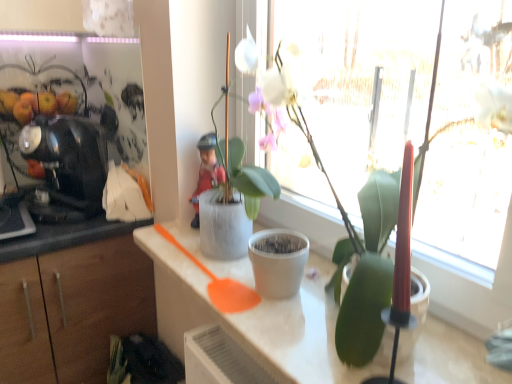
The image size is (512, 384). What are the coordinates of `white matte pot at center, arranged as the second houseplant when viewed from the front` in the screenshot? It's located at (233, 204).

Where is `white matte countertop at center`? The width and height of the screenshot is (512, 384). white matte countertop at center is located at coordinates (253, 318).

Measure the distance between point (344, 257) and camera.

The depth of point (344, 257) is 26.54 inches.

Identify the location of black glossy coffee machine at left. (67, 165).

Where is `matte red figurine at center`? This screenshot has height=384, width=512. matte red figurine at center is located at coordinates (208, 165).

What do you see at coordinates (208, 165) in the screenshot? I see `matte red figurine at center` at bounding box center [208, 165].

Image resolution: width=512 pixels, height=384 pixels. What are the coordinates of `white matte flowerpot at center` in the screenshot? It's located at (278, 262).

Can you confirm if black glossy coffee machine at left is positioned to the left of white matte pot at center, the first houseplant viewed from the back?

Correct, you'll find black glossy coffee machine at left to the left of white matte pot at center, the first houseplant viewed from the back.

Is black glossy coffee machine at left facing towards white matte pot at center, the first houseplant viewed from the back?

No.

Is black glossy coffee machine at left not near white matte pot at center, the first houseplant viewed from the back?

No, black glossy coffee machine at left is not far away from white matte pot at center, the first houseplant viewed from the back.

Which of these two, black glossy coffee machine at left or white matte pot at center, marked as the first houseplant in a front-to-back arrangement, is thinner?

With smaller width is black glossy coffee machine at left.

Is black glossy coffee machine at left positioned beyond the bounds of white matte pot at center, acting as the second houseplant starting from the back?

Yes, black glossy coffee machine at left is outside of white matte pot at center, acting as the second houseplant starting from the back.

From the picture: Does black glossy coffee machine at left have a lesser height compared to white matte pot at center, marked as the first houseplant in a front-to-back arrangement?

Indeed, black glossy coffee machine at left has a lesser height compared to white matte pot at center, marked as the first houseplant in a front-to-back arrangement.

Can you tell me how much white matte flowerpot at center and white matte countertop at center differ in facing direction?

0.000215 degrees.

Looking at this image, from the image's perspective, is white matte flowerpot at center above or below white matte countertop at center?

white matte flowerpot at center is above white matte countertop at center.

Looking at this image, which is nearer, [280,237] or [222,325]?

The point [222,325] is closer to the camera.

From a real-world perspective, relative to white matte countertop at center, is white matte flowerpot at center vertically above or below?

Clearly, from a real-world perspective, white matte flowerpot at center is above white matte countertop at center.

Looking at this image, is white matte pot at center, arranged as the second houseplant when viewed from the front, positioned beyond the bounds of white matte pot at center, acting as the second houseplant starting from the back?

Absolutely, white matte pot at center, arranged as the second houseplant when viewed from the front, is external to white matte pot at center, acting as the second houseplant starting from the back.

From a real-world perspective, is white matte pot at center, arranged as the second houseplant when viewed from the front, positioned under white matte pot at center, marked as the first houseplant in a front-to-back arrangement, based on gravity?

Yes, from a real-world perspective, white matte pot at center, arranged as the second houseplant when viewed from the front, is beneath white matte pot at center, marked as the first houseplant in a front-to-back arrangement.

Is white matte pot at center, the first houseplant viewed from the back, smaller than white matte pot at center, marked as the first houseplant in a front-to-back arrangement?

Yes, white matte pot at center, the first houseplant viewed from the back, is smaller than white matte pot at center, marked as the first houseplant in a front-to-back arrangement.

Is white matte pot at center, arranged as the second houseplant when viewed from the front, touching white matte pot at center, acting as the second houseplant starting from the back?

They are not placed beside each other.

Which of these two, white matte countertop at center or white matte pot at center, arranged as the second houseplant when viewed from the front, is smaller?

white matte countertop at center is smaller.

What's the angular difference between white matte countertop at center and white matte pot at center, arranged as the second houseplant when viewed from the front,'s facing directions?

white matte countertop at center and white matte pot at center, arranged as the second houseplant when viewed from the front, are facing 5.86e-05 degrees away from each other.

From the image's perspective, is white matte countertop at center positioned above or below white matte pot at center, arranged as the second houseplant when viewed from the front?

From the image's perspective, white matte countertop at center appears below white matte pot at center, arranged as the second houseplant when viewed from the front.

Is black glossy coffee machine at left surrounding white matte flowerpot at center?

That's incorrect, white matte flowerpot at center is not inside black glossy coffee machine at left.

Looking at this image, does black glossy coffee machine at left come behind white matte flowerpot at center?

Yes.

Which is in front, point (11, 226) or point (296, 272)?

Point (296, 272)

From the image's perspective, which one is positioned lower, black glossy coffee machine at left or white matte flowerpot at center?

white matte flowerpot at center is shown below in the image.

Considering their positions, is white matte pot at center, acting as the second houseplant starting from the back, located in front of or behind white matte flowerpot at center?

white matte pot at center, acting as the second houseplant starting from the back, is positioned closer to the viewer than white matte flowerpot at center.

From the image's perspective, is white matte pot at center, marked as the first houseplant in a front-to-back arrangement, located above or below white matte flowerpot at center?

From the image's perspective, white matte pot at center, marked as the first houseplant in a front-to-back arrangement, appears above white matte flowerpot at center.

Can you confirm if white matte pot at center, acting as the second houseplant starting from the back, is shorter than white matte flowerpot at center?

In fact, white matte pot at center, acting as the second houseplant starting from the back, may be taller than white matte flowerpot at center.

Locate an element on the screen. The width and height of the screenshot is (512, 384). appliance behind the white matte pot at center, the first houseplant viewed from the back is located at coordinates (15, 216).

Locate an element on the screen. The height and width of the screenshot is (384, 512). the 2nd houseplant in front of the black glossy coffee machine at left, starting your count from the anchor is located at coordinates (351, 224).

Which object lies nearer to the anchor point black glossy coffee machine at left, white matte countertop at center or white matte pot at center, marked as the first houseplant in a front-to-back arrangement?

white matte countertop at center is closer to black glossy coffee machine at left.

Based on their spatial positions, is matte red figurine at center or black glossy coffee machine at left further from white matte countertop at center?

black glossy coffee machine at left lies further to white matte countertop at center than the other object.

Estimate the real-world distances between objects in this image. Which object is closer to black glossy coffee machine at left, white matte pot at center, arranged as the second houseplant when viewed from the front, or white matte countertop at center?

white matte countertop at center.

From the image, which object appears to be nearer to matte red figurine at center, black glossy coffee machine at left or white matte countertop at center?

The object closer to matte red figurine at center is white matte countertop at center.

From the image, which object appears to be nearer to white matte countertop at center, black glossy coffee machine at left or white matte flowerpot at center?

white matte flowerpot at center.

Estimate the real-world distances between objects in this image. Which object is closer to white matte pot at center, marked as the first houseplant in a front-to-back arrangement, matte red figurine at center or black glossy coffee machine at left?

matte red figurine at center is positioned closer to the anchor white matte pot at center, marked as the first houseplant in a front-to-back arrangement.

Consider the image. Which object lies further to the anchor point black glossy coffee machine at left, black glossy coffee machine at left or white matte flowerpot at center?

white matte flowerpot at center is positioned further to the anchor black glossy coffee machine at left.

When comparing their distances from black glossy coffee machine at left, does white matte countertop at center or matte red figurine at center seem further?

Among the two, white matte countertop at center is located further to black glossy coffee machine at left.

The height and width of the screenshot is (384, 512). Identify the location of coffee machine located between black glossy coffee machine at left and matte red figurine at center in the left-right direction. (67, 165).

The width and height of the screenshot is (512, 384). Find the location of `countertop between white matte pot at center, marked as the first houseplant in a front-to-back arrangement, and white matte flowerpot at center from front to back`. countertop between white matte pot at center, marked as the first houseplant in a front-to-back arrangement, and white matte flowerpot at center from front to back is located at coordinates (253, 318).

Identify the location of person between black glossy coffee machine at left and white matte pot at center, the first houseplant viewed from the back. This screenshot has width=512, height=384. (208, 165).

I want to click on flowerpot between black glossy coffee machine at left and white matte pot at center, marked as the first houseplant in a front-to-back arrangement, in the horizontal direction, so click(278, 262).